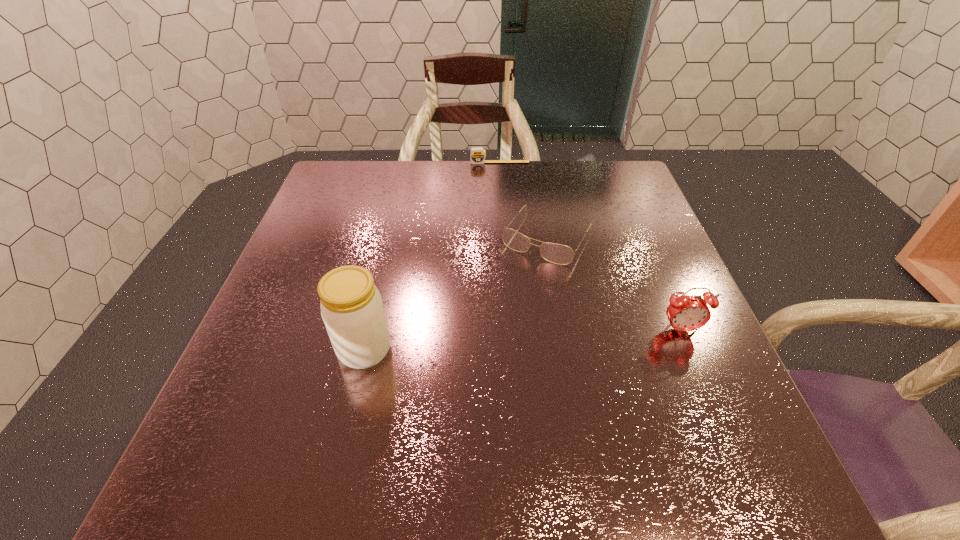
Image resolution: width=960 pixels, height=540 pixels. What are the coordinates of `vacant space on the desktop that is between the leftmost object and the rightmost object and is positioned on the front-facing side of the spectacles` in the screenshot? It's located at (481, 342).

Where is `free space on the desktop that is between the tallest object and the rightmost object and is positioned at the front of the tape measure with the tape extended`? This screenshot has width=960, height=540. free space on the desktop that is between the tallest object and the rightmost object and is positioned at the front of the tape measure with the tape extended is located at coordinates (516, 340).